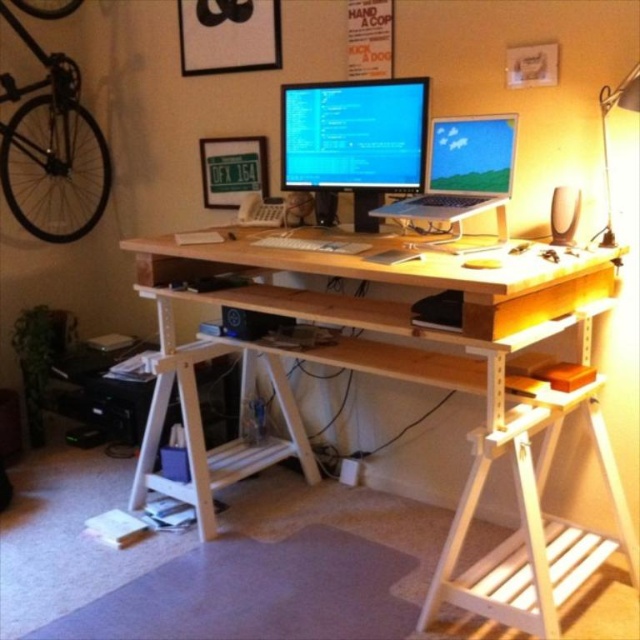
Question: Is the position of metallic silver desk lamp at upper right more distant than that of white matte keyboard at center?

Choices:
 (A) yes
 (B) no

Answer: (B)

Question: Which is farther from the metallic silver desk lamp at upper right?

Choices:
 (A) black matte bicycle at upper left
 (B) white matte keyboard at center
 (C) matte black laptop at center
 (D) matte black monitor at center

Answer: (A)

Question: Estimate the real-world distances between objects in this image. Which object is closer to the white matte keyboard at center?

Choices:
 (A) matte black monitor at center
 (B) metallic silver desk lamp at upper right
 (C) matte black laptop at center
 (D) black matte bicycle at upper left

Answer: (C)

Question: Can you confirm if black matte bicycle at upper left is smaller than matte black laptop at center?

Choices:
 (A) no
 (B) yes

Answer: (A)

Question: Which object is farther from the camera taking this photo?

Choices:
 (A) metallic silver desk lamp at upper right
 (B) black matte bicycle at upper left

Answer: (B)

Question: Is matte black monitor at center further to camera compared to matte black laptop at center?

Choices:
 (A) no
 (B) yes

Answer: (B)